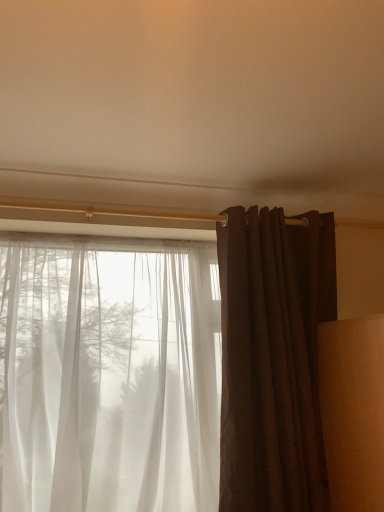
Question: Relative to sheer white curtain at left, which is counted as the second curtain, starting from the right, is matte brown curtain at right, the 1th curtain when ordered from right to left, in front or behind?

Choices:
 (A) front
 (B) behind

Answer: (B)

Question: Does point (292, 468) appear closer or farther from the camera than point (145, 470)?

Choices:
 (A) closer
 (B) farther

Answer: (A)

Question: Looking at the image, does matte brown curtain at right, the second curtain in the left-to-right sequence, seem bigger or smaller compared to sheer white curtain at left, which is counted as the second curtain, starting from the right?

Choices:
 (A) big
 (B) small

Answer: (B)

Question: Relative to matte brown curtain at right, the 1th curtain when ordered from right to left, is sheer white curtain at left, arranged as the 1th curtain when viewed from the left, in front or behind?

Choices:
 (A) behind
 (B) front

Answer: (B)

Question: Looking at the image, does sheer white curtain at left, which is counted as the second curtain, starting from the right, seem bigger or smaller compared to matte brown curtain at right, the second curtain in the left-to-right sequence?

Choices:
 (A) big
 (B) small

Answer: (A)

Question: In terms of height, does sheer white curtain at left, arranged as the 1th curtain when viewed from the left, look taller or shorter compared to matte brown curtain at right, the 1th curtain when ordered from right to left?

Choices:
 (A) tall
 (B) short

Answer: (B)

Question: Considering the positions of sheer white curtain at left, arranged as the 1th curtain when viewed from the left, and matte brown curtain at right, the second curtain in the left-to-right sequence, in the image, is sheer white curtain at left, arranged as the 1th curtain when viewed from the left, wider or thinner than matte brown curtain at right, the second curtain in the left-to-right sequence,?

Choices:
 (A) wide
 (B) thin

Answer: (A)